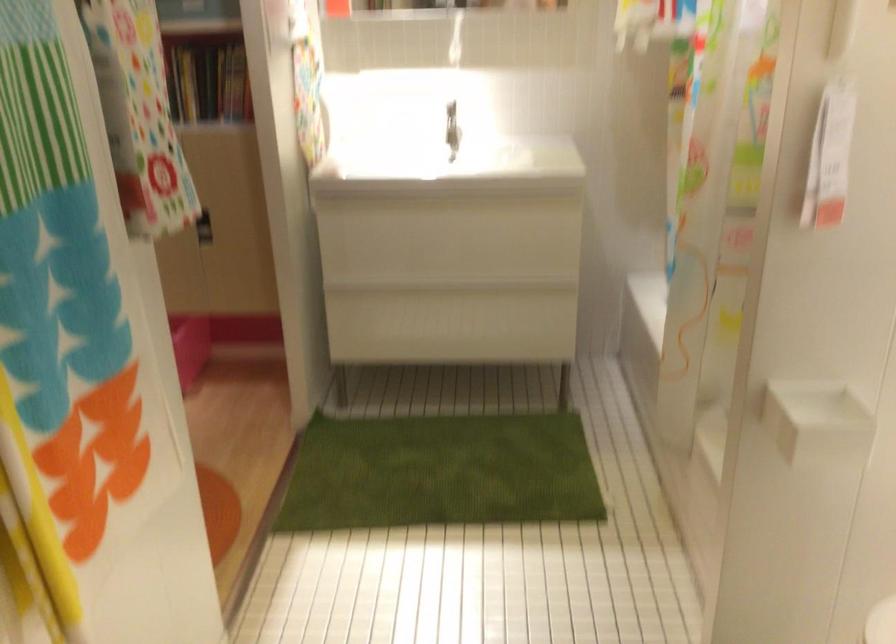
Identify the location of small white container. click(x=816, y=422).